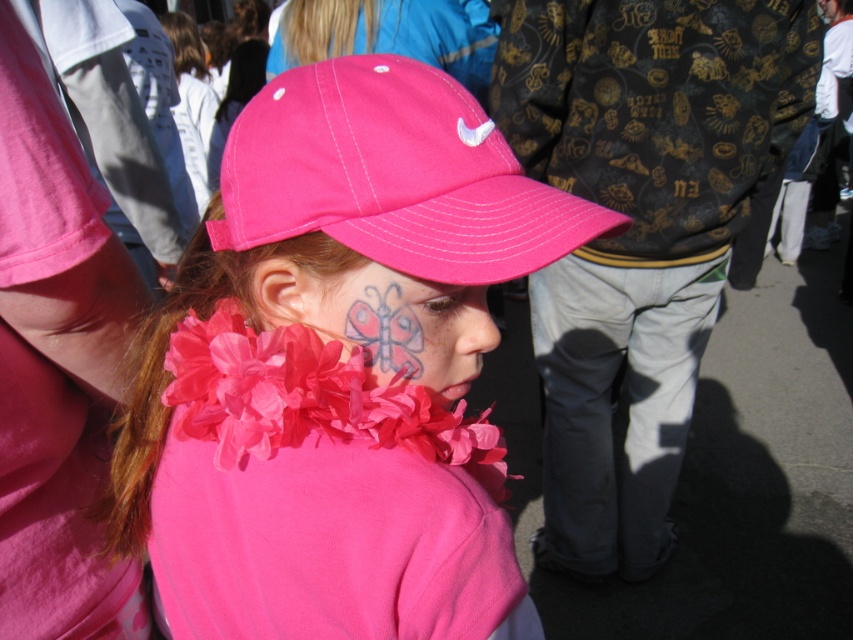
You are a photographer at the event and want to capture the girl wearing the matte pink cap at center and the matte pink baseball cap at center. Which one should you focus on to ensure it appears larger in the photo?

The matte pink cap at center has a larger size compared to the matte pink baseball cap at center, so focusing on the matte pink cap at center will make it appear larger in the photo.

You are a photographer at a festival and need to capture a clear shot of both the matte pink cap at center and the matte pink butterfly at center. Since the camera can only focus on one object at a time, which object should you focus on first to ensure it appears larger in the photo?

The matte pink cap at center is taller than the matte pink butterfly at center, so focusing on the matte pink cap at center first will ensure it appears larger in the photo.

In the scene shown: You are standing in the crowd at this lively event and want to move from the point at coordinate (534, 220) to the point at coordinate (357, 422). Which direction should you move to get closer to your destination?

You should move forward because point (534, 220) is closer to the viewer than point (357, 422), so moving forward will take you towards the destination.